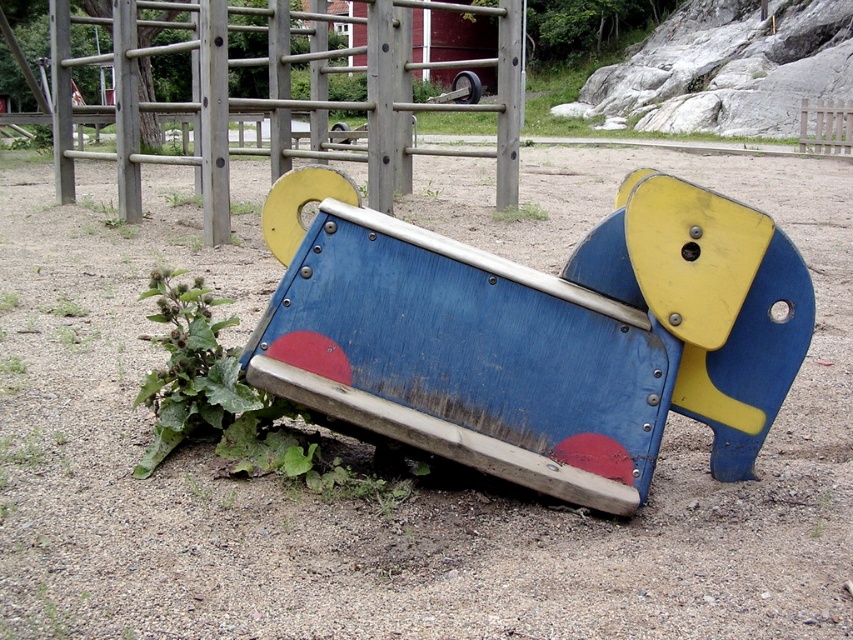
Question: Is matte blue wood slide at center smaller than green leafy plant at lower left?

Choices:
 (A) yes
 (B) no

Answer: (B)

Question: Considering the relative positions of matte blue wood slide at center and green leafy plant at lower left in the image provided, where is matte blue wood slide at center located with respect to green leafy plant at lower left?

Choices:
 (A) right
 (B) left

Answer: (A)

Question: In this image, where is matte blue wood slide at center located relative to green leafy plant at lower left?

Choices:
 (A) below
 (B) above

Answer: (B)

Question: Which point is farther to the camera?

Choices:
 (A) green leafy plant at lower left
 (B) matte blue wood slide at center

Answer: (A)